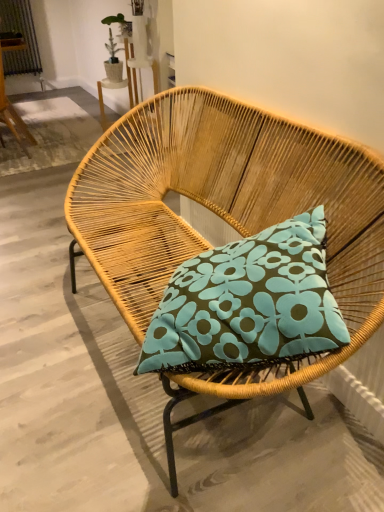
Question: Is rattan chair at upper left, which ranks as the second chair in front-to-back order, beside woven wood chair at center, the first chair when ordered from front to back?

Choices:
 (A) no
 (B) yes

Answer: (A)

Question: Could you tell me if rattan chair at upper left, which is the second chair from bottom to top, is turned towards woven wood chair at center, which is the 1th chair in right-to-left order?

Choices:
 (A) no
 (B) yes

Answer: (A)

Question: Does rattan chair at upper left, arranged as the second chair when viewed from the right, come behind woven wood chair at center, the second chair when ordered from back to front?

Choices:
 (A) no
 (B) yes

Answer: (B)

Question: Considering the relative sizes of rattan chair at upper left, which ranks as the 1th chair in back-to-front order, and woven wood chair at center, the second chair when ordered from back to front, in the image provided, is rattan chair at upper left, which ranks as the 1th chair in back-to-front order, smaller than woven wood chair at center, the second chair when ordered from back to front,?

Choices:
 (A) no
 (B) yes

Answer: (B)

Question: From the image's perspective, is rattan chair at upper left, which is the second chair from bottom to top, on top of woven wood chair at center, which ranks as the second chair in top-to-bottom order?

Choices:
 (A) yes
 (B) no

Answer: (A)

Question: Can you confirm if rattan chair at upper left, arranged as the second chair when viewed from the right, is shorter than woven wood chair at center, placed as the 1th chair when sorted from bottom to top?

Choices:
 (A) no
 (B) yes

Answer: (A)

Question: Is woven wood chair at center, which is the 1th chair in right-to-left order, positioned far away from rattan chair at upper left, marked as the first chair in a top-to-bottom arrangement?

Choices:
 (A) yes
 (B) no

Answer: (A)

Question: Is woven wood chair at center, the second chair when ordered from back to front, next to rattan chair at upper left, which is the second chair from bottom to top?

Choices:
 (A) no
 (B) yes

Answer: (A)

Question: Does woven wood chair at center, placed as the 1th chair when sorted from bottom to top, have a greater height compared to rattan chair at upper left, which is the second chair from bottom to top?

Choices:
 (A) no
 (B) yes

Answer: (A)

Question: Can you confirm if woven wood chair at center, which is the 1th chair in right-to-left order, is bigger than rattan chair at upper left, arranged as the second chair when viewed from the right?

Choices:
 (A) no
 (B) yes

Answer: (B)

Question: Would you say rattan chair at upper left, acting as the first chair starting from the left, is part of woven wood chair at center, placed as the 1th chair when sorted from bottom to top,'s contents?

Choices:
 (A) yes
 (B) no

Answer: (B)

Question: Is woven wood chair at center, the second chair when ordered from back to front, not within rattan chair at upper left, arranged as the second chair when viewed from the right?

Choices:
 (A) yes
 (B) no

Answer: (A)

Question: From the image's perspective, is woven wood chair at center, positioned as the second chair in left-to-right order, above or below rattan chair at upper left, which ranks as the second chair in front-to-back order?

Choices:
 (A) above
 (B) below

Answer: (B)